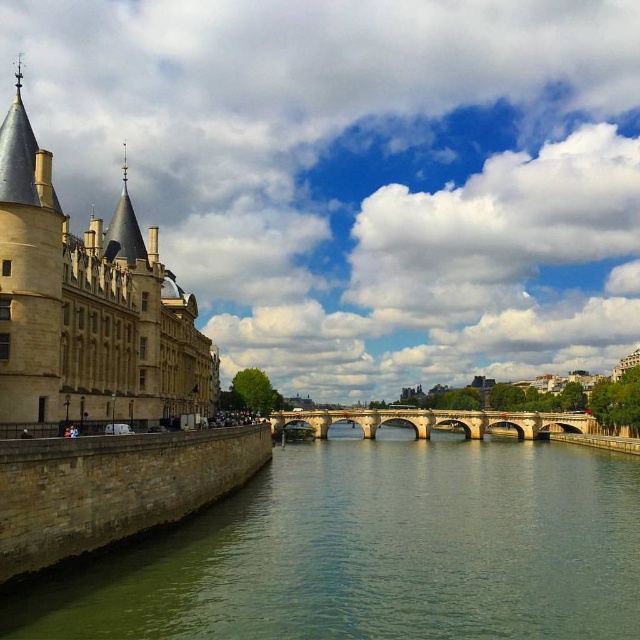
Question: Is beige stone castle at left smaller than stone bridge at center?

Choices:
 (A) yes
 (B) no

Answer: (B)

Question: Which object is farther from the camera taking this photo?

Choices:
 (A) green stone river at center
 (B) beige stone castle at left
 (C) stone bridge at center

Answer: (C)

Question: Which point appears farthest from the camera in this image?

Choices:
 (A) (180, 385)
 (B) (536, 420)

Answer: (B)

Question: Which point appears farthest from the camera in this image?

Choices:
 (A) click(337, 429)
 (B) click(394, 417)

Answer: (A)

Question: Observing the image, what is the correct spatial positioning of green stone river at center in reference to beige stone castle at left?

Choices:
 (A) below
 (B) above

Answer: (A)

Question: Observing the image, what is the correct spatial positioning of green stone river at center in reference to stone bridge at center?

Choices:
 (A) below
 (B) above

Answer: (B)